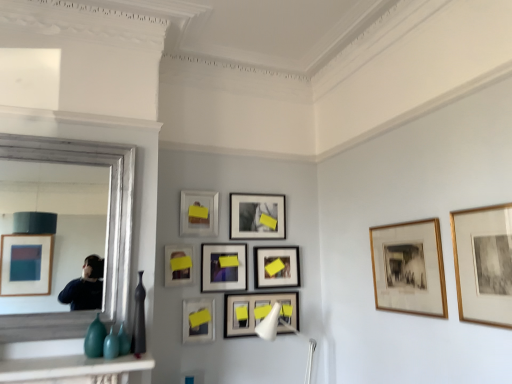
At what (x,y) coordinates should I click in order to perform the action: click on vacant space underneath silver framed mirror at left (from a real-world perspective). Please return your answer as a coordinate pair (x, y). The image size is (512, 384). Looking at the image, I should click on (49, 354).